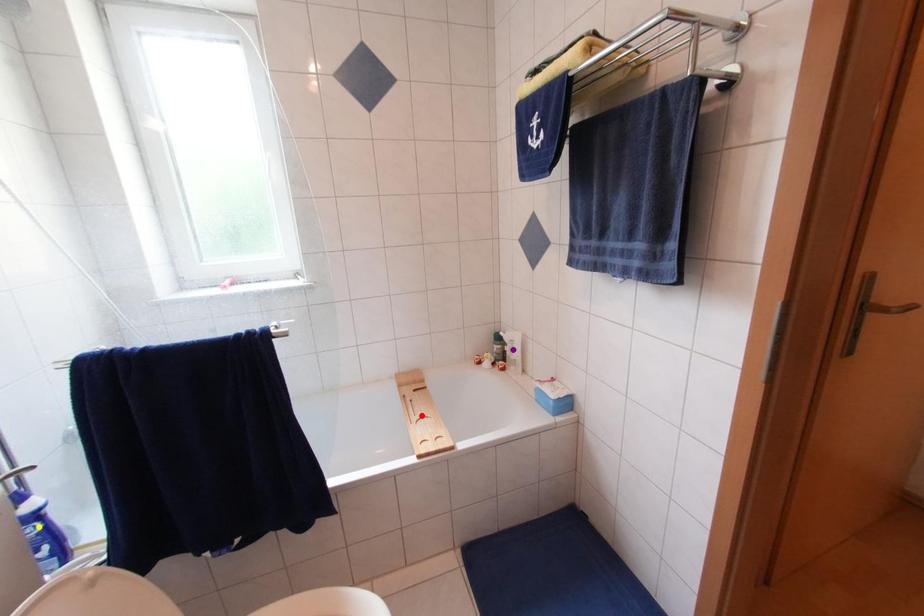
Order these from nearest to farthest:
1. purple point
2. yellow point
3. red point

purple point → red point → yellow point